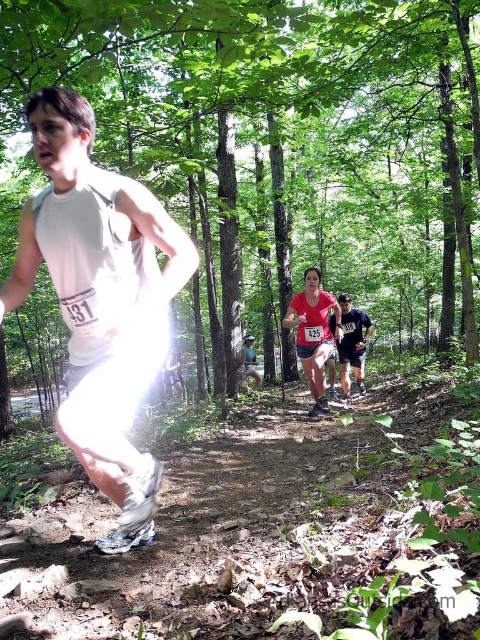
Question: Can you confirm if matte pink tank top at center is wider than dark blue jersey at center?

Choices:
 (A) no
 (B) yes

Answer: (B)

Question: Among these points, which one is farthest from the camera?

Choices:
 (A) (96, 259)
 (B) (330, 326)

Answer: (B)

Question: Among these points, which one is farthest from the camera?

Choices:
 (A) (124, 538)
 (B) (335, 330)

Answer: (B)

Question: Does white matte shorts at center have a larger size compared to dark blue jersey at center?

Choices:
 (A) no
 (B) yes

Answer: (A)

Question: Based on their relative distances, which object is farther from the white matte shorts at center?

Choices:
 (A) matte pink tank top at center
 (B) dark blue jersey at center

Answer: (B)

Question: Does matte pink tank top at center have a lesser width compared to dark blue jersey at center?

Choices:
 (A) yes
 (B) no

Answer: (B)